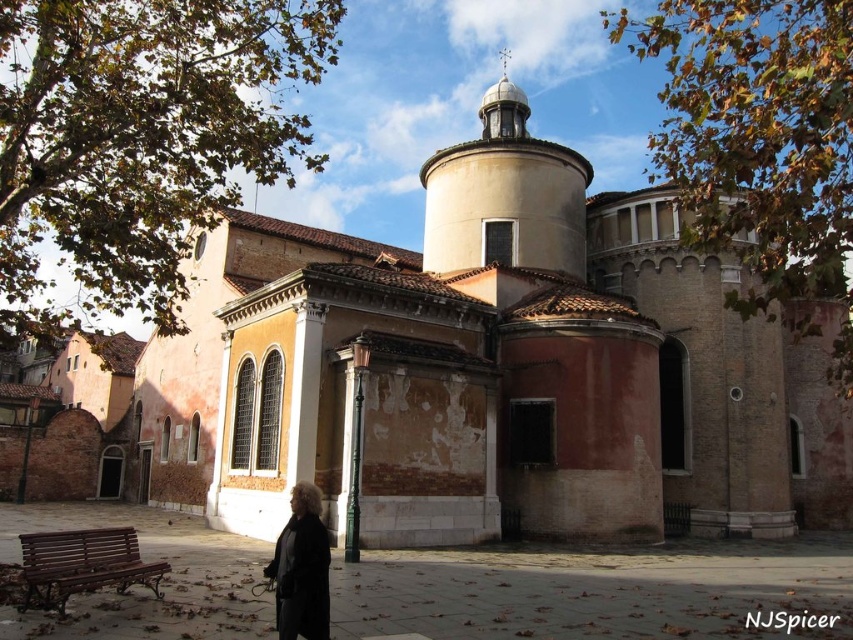
You are a visitor standing at the entrance of the historic building and see the smooth white dome at upper center and the black wool coat at lower left. Which object is wider?

The smooth white dome at upper center is wider than the black wool coat at lower left according to the description.

You are standing in front of the historic building and want to determine the relative positions of two points marked on the facade. Which point is closer to you, point (x=494, y=259) or point (x=303, y=630)?

Point (x=494, y=259) is further to the viewer than point (x=303, y=630). Therefore, point (x=303, y=630) is closer to you.

You are standing in front of the historic church and want to take a photo. You notice two points marked on the building. The first point is at coordinates point (540, 264) and the second is at point (61, 556). Which point is closer to your camera?

Point (61, 556) is closer to the camera because the description states that point (540, 264) is further away from the camera than point (61, 556).